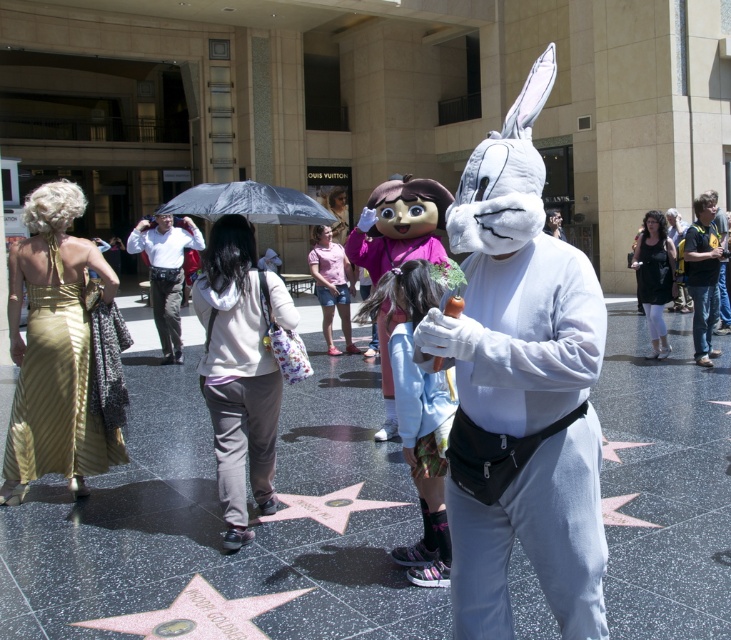
You are a photographer trying to capture the gold reflective star at center and the light gray fleece hoodie at center in the same frame. Which object should you adjust your camera to focus on first if you want to include both in your shot?

The light gray fleece hoodie at center is positioned on the left side of gold reflective star at center, so you should focus on the gold reflective star at center first to ensure both objects are in frame.

You are a photographer standing at the Hollywood Walk of Fame. You want to take a photo of the gold reflective star at center without the light gray fleece hoodie at center blocking it. Can you adjust your position to achieve this?

The light gray fleece hoodie at center is in front of the gold reflective star at center. By moving your position to the side or behind the hoodie, you can capture the star without obstruction.

You are a photographer standing at the Hollywood Walk of Fame. You want to take a photo of the white cotton shirt at center and the gray matte umbrella at center. Which object is providing shade to the other?

The gray matte umbrella at center is providing shade to the white cotton shirt at center because it is positioned above it.